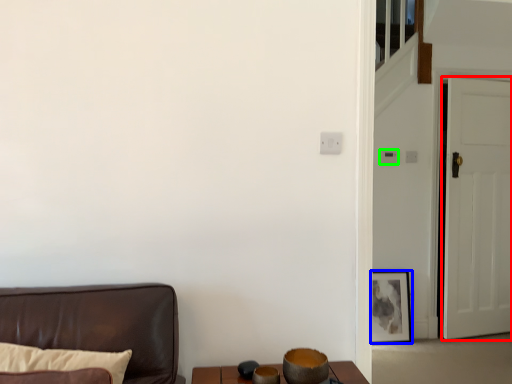
Question: Estimate the real-world distances between objects in this image. Which object is farther from door (highlighted by a red box), picture frame (highlighted by a blue box) or light switch (highlighted by a green box)?

Choices:
 (A) picture frame
 (B) light switch

Answer: (B)